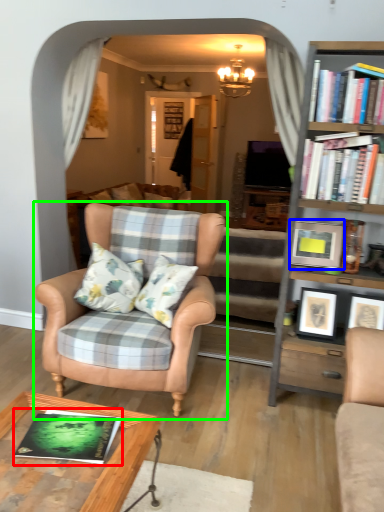
Question: Considering the real-world distances, which object is farthest from book (highlighted by a red box)? picture frame (highlighted by a blue box) or chair (highlighted by a green box)?

Choices:
 (A) picture frame
 (B) chair

Answer: (A)